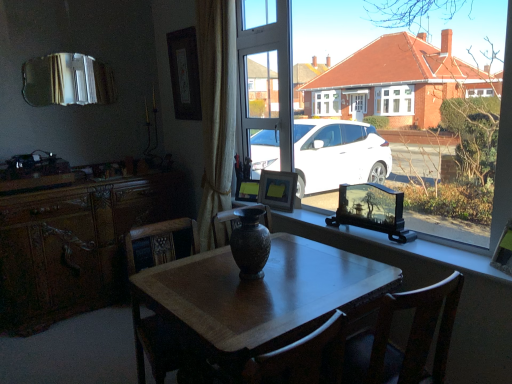
This screenshot has height=384, width=512. I want to click on free space above silver reflective mirror at upper left (from a real-world perspective), so click(x=74, y=45).